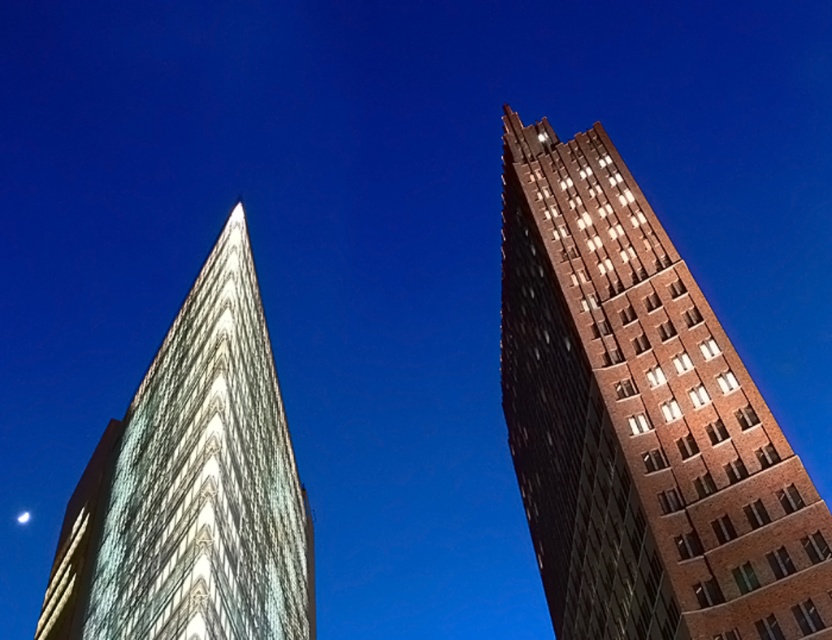
Question: Is brown brick building at upper right to the right of white glass building at left from the viewer's perspective?

Choices:
 (A) yes
 (B) no

Answer: (A)

Question: Which point appears farthest from the camera in this image?

Choices:
 (A) click(721, 634)
 (B) click(281, 556)

Answer: (B)

Question: In this image, where is brown brick building at upper right located relative to white glass building at left?

Choices:
 (A) above
 (B) below

Answer: (A)

Question: Is brown brick building at upper right in front of white glass building at left?

Choices:
 (A) yes
 (B) no

Answer: (A)

Question: Among these objects, which one is farthest from the camera?

Choices:
 (A) brown brick building at upper right
 (B) white glass building at left

Answer: (B)

Question: Among these objects, which one is nearest to the camera?

Choices:
 (A) white glass building at left
 (B) brown brick building at upper right

Answer: (B)